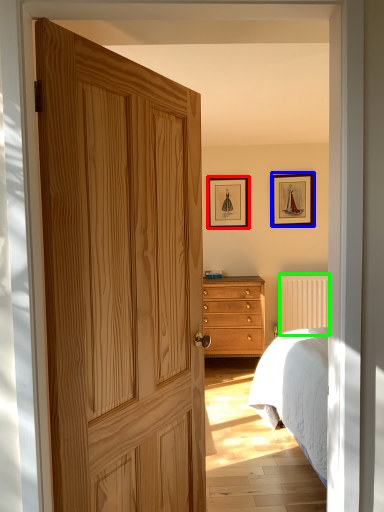
Question: Considering the real-world distances, which object is farthest from picture frame (highlighted by a red box)? picture frame (highlighted by a blue box) or radiator (highlighted by a green box)?

Choices:
 (A) picture frame
 (B) radiator

Answer: (B)